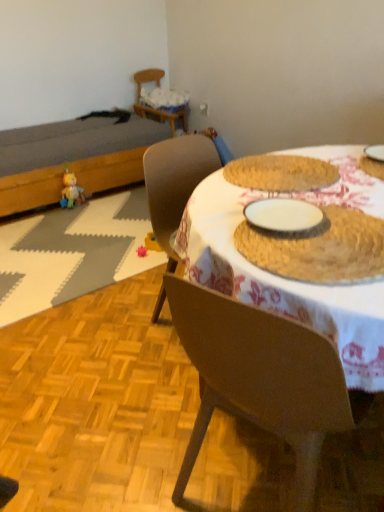
What is the approximate width of brown matte chair at center, which is the first chair from bottom to top?

brown matte chair at center, which is the first chair from bottom to top, is 21.38 inches wide.

Describe the element at coordinates (72, 252) in the screenshot. I see `white woven placemat at left` at that location.

Image resolution: width=384 pixels, height=512 pixels. Identify the location of white woven placemat at left. (72, 252).

The image size is (384, 512). Describe the element at coordinates (72, 158) in the screenshot. I see `dark brown wooden bed at left` at that location.

Locate an element on the screen. pink fabric toy at lower center, which ranks as the second toy in left-to-right order is located at coordinates (141, 251).

The width and height of the screenshot is (384, 512). I want to click on plush yellow duck at left, the 1th toy when ordered from back to front, so click(x=71, y=191).

Does dark brown wooden bed at left turn towards white woven placemat at left?

Yes.

Can you confirm if dark brown wooden bed at left is smaller than white woven placemat at left?

No, dark brown wooden bed at left is not smaller than white woven placemat at left.

From their relative heights in the image, would you say dark brown wooden bed at left is taller or shorter than white woven placemat at left?

Clearly, dark brown wooden bed at left is taller compared to white woven placemat at left.

From the picture: How different are the orientations of dark brown wooden bed at left and white woven placemat at left in degrees?

The facing directions of dark brown wooden bed at left and white woven placemat at left are 179 degrees apart.

In terms of size, does wooden chair at upper left, which is the 2th chair from bottom to top, appear bigger or smaller than white woven placemat at left?

Clearly, wooden chair at upper left, which is the 2th chair from bottom to top, is larger in size than white woven placemat at left.

Is wooden chair at upper left, the first chair from the back, facing away from white woven placemat at left?

wooden chair at upper left, the first chair from the back, does not have its back to white woven placemat at left.

Relative to white woven placemat at left, is wooden chair at upper left, which is the 2th chair from bottom to top, in front or behind?

In the image, wooden chair at upper left, which is the 2th chair from bottom to top, appears behind white woven placemat at left.

Can you confirm if brown matte chair at center, the 2th chair when ordered from back to front, is positioned to the left of dark brown wooden bed at left?

Incorrect, brown matte chair at center, the 2th chair when ordered from back to front, is not on the left side of dark brown wooden bed at left.

Is point (307, 429) positioned after point (26, 128)?

No, (307, 429) is closer to viewer.

Image resolution: width=384 pixels, height=512 pixels. I want to click on bed that is above the brown matte chair at center, the first chair in the right-to-left sequence (from the image's perspective), so click(x=72, y=158).

Is brown matte chair at center, arranged as the 1th chair when viewed from the front, in contact with dark brown wooden bed at left?

brown matte chair at center, arranged as the 1th chair when viewed from the front, and dark brown wooden bed at left are not in contact.

Does point (79, 187) appear closer or farther from the camera than point (104, 197)?

Point (79, 187) is closer to the camera than point (104, 197).

Is plush yellow duck at left, the 1th toy when ordered from back to front, facing away from white woven placemat at left?

plush yellow duck at left, the 1th toy when ordered from back to front, does not have its back to white woven placemat at left.

How different are the orientations of plush yellow duck at left, the 1th toy when ordered from back to front, and white woven placemat at left in degrees?

They differ by 178 degrees in their facing directions.

Considering their positions, is plush yellow duck at left, the 1th toy when ordered from back to front, located in front of or behind white woven placemat at left?

In the image, plush yellow duck at left, the 1th toy when ordered from back to front, appears behind white woven placemat at left.

Is brown woven placemat at center oriented towards pink fabric toy at lower center, which is the first toy from bottom to top?

No, brown woven placemat at center is not oriented towards pink fabric toy at lower center, which is the first toy from bottom to top.

Does point (369, 269) come farther from viewer compared to point (144, 248)?

No.

Which toy is the 1st one when counting from the back of the brown woven placemat at center? Please provide its 2D coordinates.

[(141, 251)]

Between brown woven placemat at center and pink fabric toy at lower center, arranged as the first toy when viewed from the front, which one has more height?

A: pink fabric toy at lower center, arranged as the first toy when viewed from the front.

Is dark brown wooden bed at left touching wooden chair at upper left, which is counted as the 1th chair, starting from the top?

dark brown wooden bed at left is not next to wooden chair at upper left, which is counted as the 1th chair, starting from the top, and they're not touching.

Which is more to the right, dark brown wooden bed at left or wooden chair at upper left, the 2th chair from the front?

wooden chair at upper left, the 2th chair from the front.

Measure the distance between dark brown wooden bed at left and wooden chair at upper left, the 2th chair from the front.

dark brown wooden bed at left and wooden chair at upper left, the 2th chair from the front, are 30.32 inches apart from each other.

What's the angular difference between dark brown wooden bed at left and wooden chair at upper left, the first chair from the back,'s facing directions?

The facing directions of dark brown wooden bed at left and wooden chair at upper left, the first chair from the back, are 9.36 degrees apart.

How many degrees apart are the facing directions of pink fabric toy at lower center, which is counted as the second toy, starting from the top, and wooden chair at upper left, which is the 2th chair in right-to-left order?

They differ by 107 degrees in their facing directions.

From the image's perspective, does pink fabric toy at lower center, the 2th toy when ordered from back to front, appear lower than wooden chair at upper left, which is the 2th chair in right-to-left order?

Yes, from the image's perspective, pink fabric toy at lower center, the 2th toy when ordered from back to front, is below wooden chair at upper left, which is the 2th chair in right-to-left order.

Based on the photo, considering the relative positions of pink fabric toy at lower center, arranged as the first toy when viewed from the front, and wooden chair at upper left, which is counted as the 1th chair, starting from the top, in the image provided, is pink fabric toy at lower center, arranged as the first toy when viewed from the front, to the left of wooden chair at upper left, which is counted as the 1th chair, starting from the top, from the viewer's perspective?

Correct, you'll find pink fabric toy at lower center, arranged as the first toy when viewed from the front, to the left of wooden chair at upper left, which is counted as the 1th chair, starting from the top.

Is pink fabric toy at lower center, which is the first toy from bottom to top, located outside wooden chair at upper left, which is the 2th chair from bottom to top?

Yes, pink fabric toy at lower center, which is the first toy from bottom to top, is located beyond the bounds of wooden chair at upper left, which is the 2th chair from bottom to top.

Identify the location of place mat below the dark brown wooden bed at left (from the image's perspective). This screenshot has width=384, height=512. (72, 252).

Identify the location of place mat that appears on the left of wooden chair at upper left, the 2th chair from the front. (72, 252).

Based on their spatial positions, is plush yellow duck at left, positioned as the 1th toy in top-to-bottom order, or brown wood table at center further from brown woven placemat at center?

Based on the image, plush yellow duck at left, positioned as the 1th toy in top-to-bottom order, appears to be further to brown woven placemat at center.

Estimate the real-world distances between objects in this image. Which object is further from dark brown wooden bed at left, pink fabric toy at lower center, which is the first toy from bottom to top, or white woven placemat at left?

pink fabric toy at lower center, which is the first toy from bottom to top, is further to dark brown wooden bed at left.

When comparing their distances from white woven placemat at left, does pink fabric toy at lower center, which is the first toy from bottom to top, or brown matte chair at center, acting as the 2th chair starting from the left, seem closer?

pink fabric toy at lower center, which is the first toy from bottom to top, lies closer to white woven placemat at left than the other object.

Estimate the real-world distances between objects in this image. Which object is further from white woven placemat at left, brown matte chair at center, the 2th chair when ordered from back to front, or brown wood table at center?

brown matte chair at center, the 2th chair when ordered from back to front, lies further to white woven placemat at left than the other object.

Estimate the real-world distances between objects in this image. Which object is further from wooden chair at upper left, the 2th chair from the front, brown matte chair at center, the 2th chair when ordered from back to front, or pink fabric toy at lower center, which is the first toy from bottom to top?

brown matte chair at center, the 2th chair when ordered from back to front.

When comparing their distances from white woven placemat at left, does plush yellow duck at left, which is the second toy from front to back, or brown matte chair at center, acting as the 2th chair starting from the left, seem closer?

plush yellow duck at left, which is the second toy from front to back, lies closer to white woven placemat at left than the other object.

Consider the image. Which object lies nearer to the anchor point brown wood table at center, wooden chair at upper left, the 2th chair from the front, or dark brown wooden bed at left?

dark brown wooden bed at left is positioned closer to the anchor brown wood table at center.

Looking at the image, which one is located further to white woven placemat at left, brown wood table at center or brown matte chair at center, the 2th chair when ordered from back to front?

brown matte chair at center, the 2th chair when ordered from back to front.

Where is `food between brown matte chair at center, which is counted as the 2th chair, starting from the top, and plush yellow duck at left, the 2th toy when ordered from bottom to top, along the z-axis`? Image resolution: width=384 pixels, height=512 pixels. food between brown matte chair at center, which is counted as the 2th chair, starting from the top, and plush yellow duck at left, the 2th toy when ordered from bottom to top, along the z-axis is located at coordinates (319, 249).

I want to click on place mat between brown matte chair at center, the first chair in the right-to-left sequence, and plush yellow duck at left, the 2th toy when ordered from bottom to top, along the z-axis, so click(72, 252).

This screenshot has width=384, height=512. Find the location of `chair between brown wood table at center and plush yellow duck at left, the 2th toy when ordered from bottom to top, in the front-back direction`. chair between brown wood table at center and plush yellow duck at left, the 2th toy when ordered from bottom to top, in the front-back direction is located at coordinates (259, 379).

The image size is (384, 512). Identify the location of food between brown matte chair at center, acting as the 2th chair starting from the left, and wooden chair at upper left, which is the 2th chair from bottom to top, along the z-axis. (319, 249).